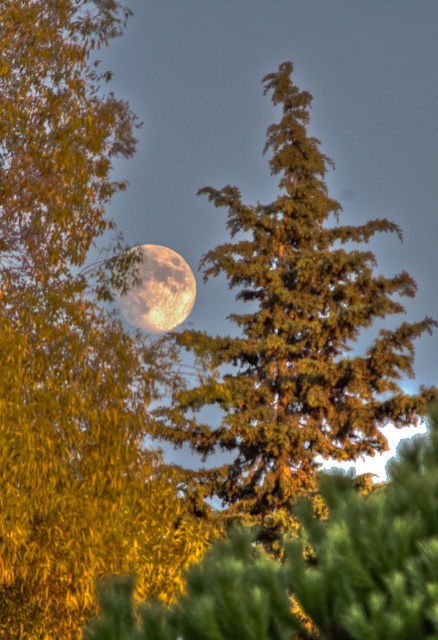
Question: Is yellow-green leaves at upper left further to the viewer compared to green textured pine tree at center?

Choices:
 (A) no
 (B) yes

Answer: (A)

Question: Is yellow-green leaves at upper left positioned behind green textured pine tree at center?

Choices:
 (A) no
 (B) yes

Answer: (A)

Question: Among these objects, which one is nearest to the camera?

Choices:
 (A) golden textured moon at center
 (B) green textured pine tree at center

Answer: (A)

Question: Is green textured pine tree at center to the left of golden textured moon at center from the viewer's perspective?

Choices:
 (A) no
 (B) yes

Answer: (A)

Question: Which of these objects is positioned closest to the golden textured moon at center?

Choices:
 (A) yellow-green leaves at upper left
 (B) green textured pine tree at center

Answer: (B)

Question: Which of the following is the closest to the observer?

Choices:
 (A) yellow-green leaves at upper left
 (B) golden textured moon at center

Answer: (A)